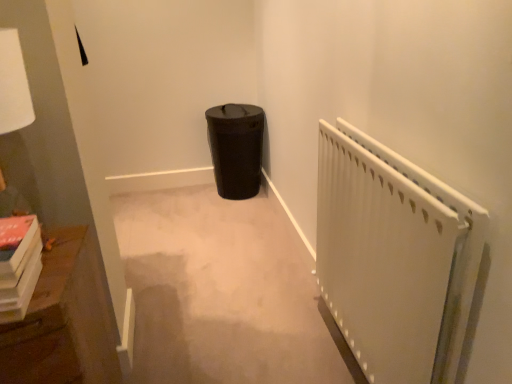
Question: From a real-world perspective, is white matte radiator at right physically above black matte trash can at center?

Choices:
 (A) yes
 (B) no

Answer: (A)

Question: From the image's perspective, is white matte radiator at right beneath black matte trash can at center?

Choices:
 (A) yes
 (B) no

Answer: (A)

Question: Is white matte radiator at right facing away from black matte trash can at center?

Choices:
 (A) no
 (B) yes

Answer: (A)

Question: Would you say white matte radiator at right is outside black matte trash can at center?

Choices:
 (A) yes
 (B) no

Answer: (A)

Question: Are white matte radiator at right and black matte trash can at center beside each other?

Choices:
 (A) no
 (B) yes

Answer: (A)

Question: Can you confirm if white matte radiator at right is shorter than black matte trash can at center?

Choices:
 (A) no
 (B) yes

Answer: (A)

Question: Could you tell me if white matte radiator at right is turned towards wooden bookshelf at left?

Choices:
 (A) yes
 (B) no

Answer: (A)

Question: Would you say white matte radiator at right contains wooden bookshelf at left?

Choices:
 (A) no
 (B) yes

Answer: (A)

Question: From a real-world perspective, is white matte radiator at right positioned under wooden bookshelf at left based on gravity?

Choices:
 (A) no
 (B) yes

Answer: (A)

Question: Considering the relative sizes of white matte radiator at right and wooden bookshelf at left in the image provided, is white matte radiator at right thinner than wooden bookshelf at left?

Choices:
 (A) no
 (B) yes

Answer: (B)

Question: From a real-world perspective, is white matte radiator at right on top of wooden bookshelf at left?

Choices:
 (A) yes
 (B) no

Answer: (A)

Question: Can you confirm if white matte radiator at right is wider than wooden bookshelf at left?

Choices:
 (A) yes
 (B) no

Answer: (B)

Question: Is black matte trash can at center positioned with its back to wooden bookshelf at left?

Choices:
 (A) no
 (B) yes

Answer: (A)